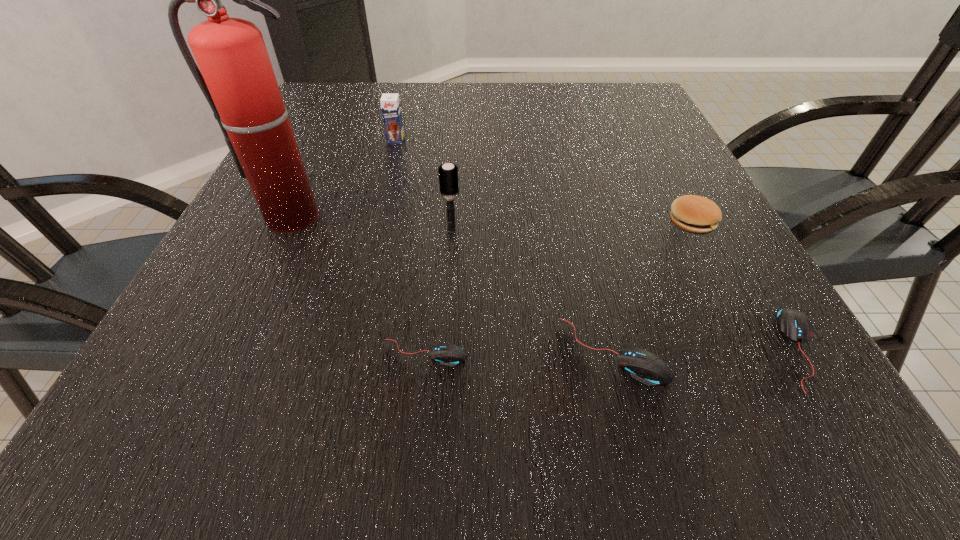
Image resolution: width=960 pixels, height=540 pixels. I want to click on hairbrush, so click(x=448, y=175).

The image size is (960, 540). Identify the location of vacant region located 0.250m on the back of the shortest object. (438, 230).

Locate an element on the screen. free space located 0.120m on the right of the third object from right to left is located at coordinates (747, 351).

Find the location of `free space located 0.290m on the back of the sixth tallest object`. free space located 0.290m on the back of the sixth tallest object is located at coordinates (708, 198).

In order to click on free space located 0.130m on the front label of the sixth object from right to left in this screenshot , I will do `click(387, 174)`.

You are a GUI agent. You are given a task and a screenshot of the screen. Output one action in this format:
    pyautogui.click(x=<x>, y=<y>)
    Task: Click on the vacant space situated 0.050m with the nozzle and gauge on the leftmost object
    
    Given the screenshot: What is the action you would take?
    pyautogui.click(x=278, y=252)

The image size is (960, 540). I want to click on blank space located 0.090m on the back of the patty, so click(x=670, y=181).

I want to click on vacant area situated 0.140m on the left of the sixth shortest object, so click(367, 230).

In order to click on object positioned at the left edge in this screenshot , I will do `click(237, 78)`.

You are a GUI agent. You are given a task and a screenshot of the screen. Output one action in this format:
    pyautogui.click(x=<x>, y=<y>)
    Task: Click on the mouse situated at the right edge
    The image size is (960, 540).
    Given the screenshot: What is the action you would take?
    pyautogui.click(x=794, y=325)